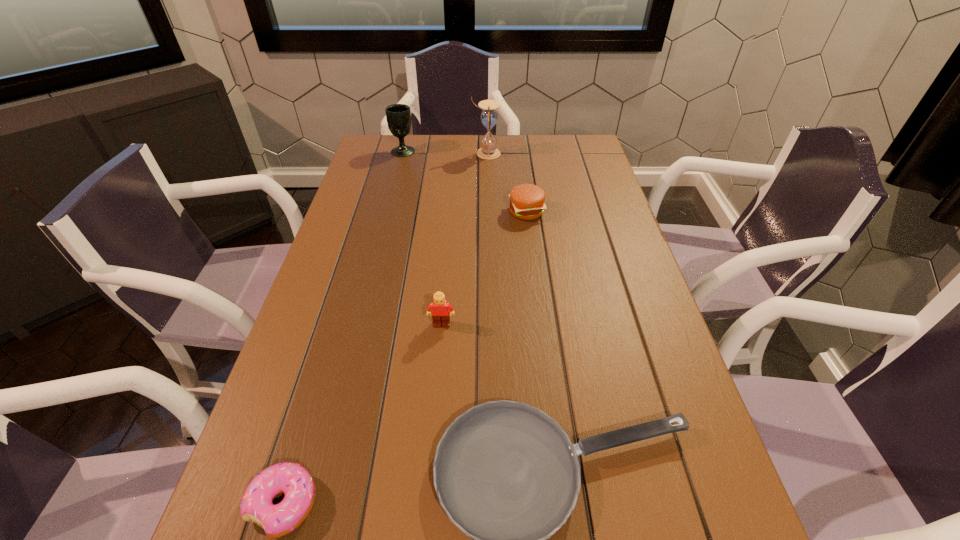
The image size is (960, 540). I want to click on the tallest object, so click(x=489, y=117).

Where is `the second tallest object`? This screenshot has height=540, width=960. the second tallest object is located at coordinates (398, 116).

The width and height of the screenshot is (960, 540). Identify the location of the third tallest object. (440, 313).

The width and height of the screenshot is (960, 540). I want to click on the third nearest object, so click(x=440, y=313).

Locate an element on the screen. This screenshot has width=960, height=540. the third shortest object is located at coordinates (526, 200).

Find the location of a particular element. This screenshot has width=960, height=540. the third farthest object is located at coordinates (526, 200).

You are a GUI agent. You are given a task and a screenshot of the screen. Output one action in this format:
    pyautogui.click(x=<x>, y=<y>)
    Task: Click on the free space located 0.310m on the right of the hourglass
    The width and height of the screenshot is (960, 540).
    Given the screenshot: What is the action you would take?
    pyautogui.click(x=589, y=153)

Identify the location of vacant space located on the front of the second tallest object. The width and height of the screenshot is (960, 540). (383, 228).

The image size is (960, 540). Find the location of `vacant space located on the face of the Lego`. vacant space located on the face of the Lego is located at coordinates (435, 411).

Locate an element on the screen. The height and width of the screenshot is (540, 960). vacant space located on the front of the fourth nearest object is located at coordinates (539, 306).